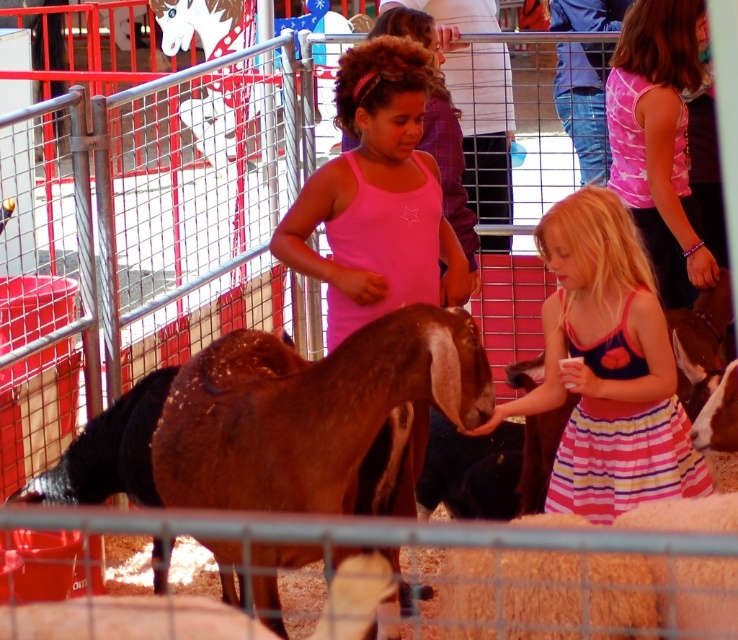
Is point (297, 458) positioned in front of point (652, 474)?

Yes, point (297, 458) is closer to viewer.

Is brown glossy goat at center further to camera compared to striped cotton dress at lower right?

No, it is not.

Which is in front, point (369, 454) or point (582, 316)?

Point (369, 454) is more forward.

This screenshot has width=738, height=640. I want to click on brown glossy goat at center, so click(x=314, y=413).

Is brown glossy goat at center bigger than fuzzy orange sheep at lower center?

Correct, brown glossy goat at center is larger in size than fuzzy orange sheep at lower center.

Which is in front, point (263, 602) or point (545, 552)?

Point (545, 552) is more forward.

The width and height of the screenshot is (738, 640). I want to click on brown glossy goat at center, so click(314, 413).

Where is `brown glossy goat at center`? The image size is (738, 640). brown glossy goat at center is located at coordinates (314, 413).

Can you confirm if brown glossy goat at center is positioned to the right of pink fabric tank top at center?

No, brown glossy goat at center is not to the right of pink fabric tank top at center.

Between point (269, 572) and point (334, 195), which one is positioned in front?

Positioned in front is point (269, 572).

Identify the location of brown glossy goat at center. This screenshot has width=738, height=640. (314, 413).